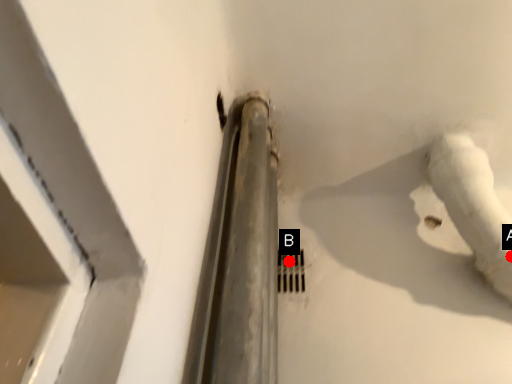
Question: Two points are circled on the image, labeled by A and B beside each circle. Which point is closer to the camera?

Choices:
 (A) A is closer
 (B) B is closer

Answer: (A)